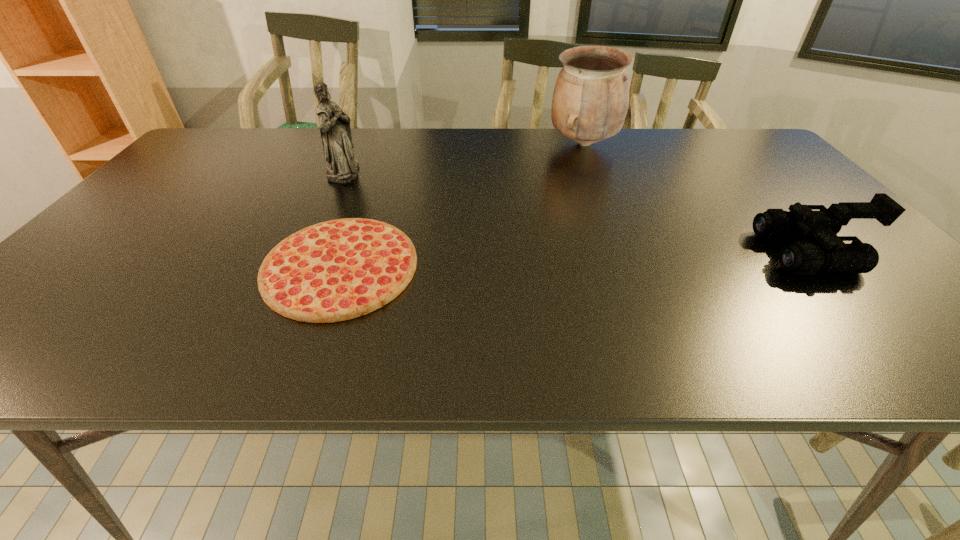
You are a GUI agent. You are given a task and a screenshot of the screen. Output one action in this format:
    pyautogui.click(x=<x>, y=<y>)
    Task: Click on the vacant point that satisfies the following two spatial constraints: 1. on the front-facing side of the figurine; 2. on the right side of the pizza
    
    Given the screenshot: What is the action you would take?
    pyautogui.click(x=300, y=267)